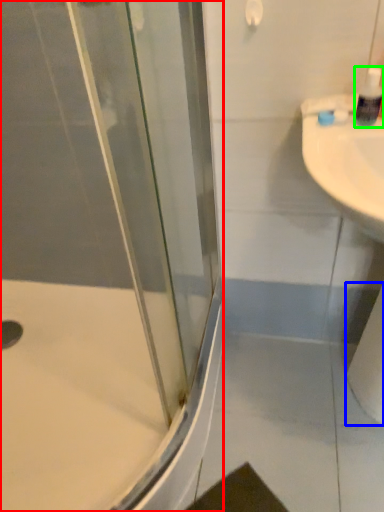
Question: Which is farther away from shower door (highlighted by a red box)? toilet paper (highlighted by a blue box) or soap dispenser (highlighted by a green box)?

Choices:
 (A) toilet paper
 (B) soap dispenser

Answer: (B)